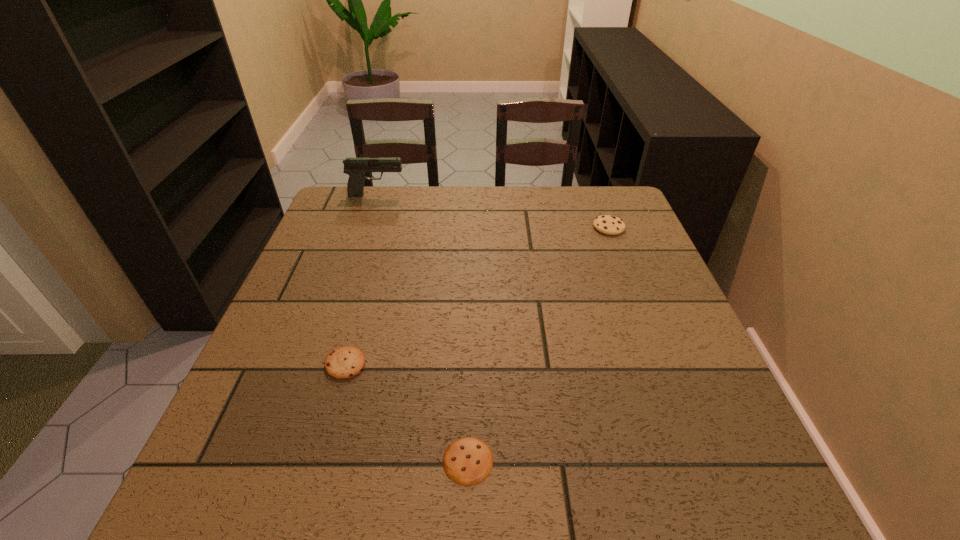
Find the location of `free space between the shortest object and the second farthest object`. free space between the shortest object and the second farthest object is located at coordinates (539, 344).

Where is `free space between the pistol and the rightmost object`? Image resolution: width=960 pixels, height=540 pixels. free space between the pistol and the rightmost object is located at coordinates (492, 211).

Where is `vacant space in between the rightmost object and the second shortest cookie`? This screenshot has width=960, height=540. vacant space in between the rightmost object and the second shortest cookie is located at coordinates (477, 295).

This screenshot has height=540, width=960. Find the location of `vacant space that's between the pistol and the nearest object`. vacant space that's between the pistol and the nearest object is located at coordinates (422, 328).

Find the location of `object that can be found as the second closest to the shortest cookie`. object that can be found as the second closest to the shortest cookie is located at coordinates (607, 224).

Where is `the closest object to the tallest object`? the closest object to the tallest object is located at coordinates (607, 224).

Locate an element on the screen. cookie identified as the second closest to the second nearest object is located at coordinates (607, 224).

In order to click on cookie that is the closest to the shortest cookie in this screenshot , I will do `click(345, 362)`.

You are a GUI agent. You are given a task and a screenshot of the screen. Output one action in this format:
    pyautogui.click(x=<x>, y=<y>)
    Task: Click on the blank space that satisfies the following two spatial constraints: 1. aim along the barrel of the shortest object; 2. on the right side of the pistol
    This screenshot has height=540, width=960.
    Given the screenshot: What is the action you would take?
    pyautogui.click(x=287, y=461)

The height and width of the screenshot is (540, 960). In order to click on free space that satisfies the following two spatial constraints: 1. on the back side of the third nearest object; 2. aim along the barrel of the tallest object in this screenshot , I will do `click(596, 195)`.